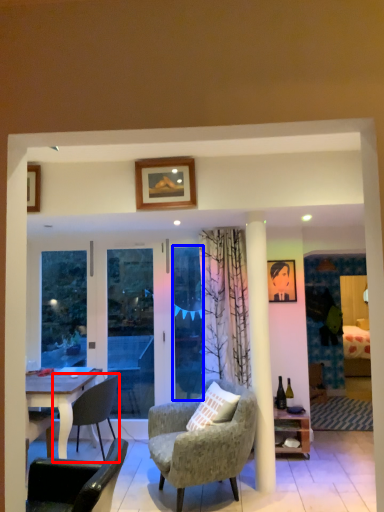
Question: Which object is further to the camera taking this photo, chair (highlighted by a red box) or glass door (highlighted by a blue box)?

Choices:
 (A) chair
 (B) glass door

Answer: (B)